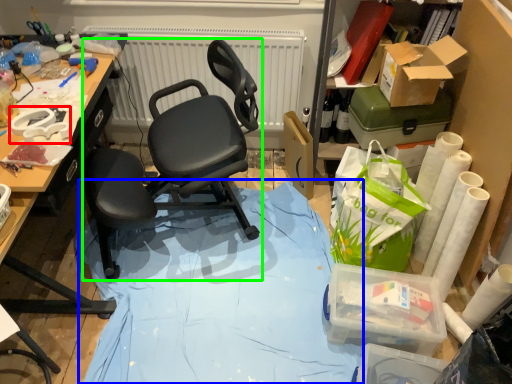
Question: Which is farther away from equipment (highlighted by a red box)? fabric (highlighted by a blue box) or chair (highlighted by a green box)?

Choices:
 (A) fabric
 (B) chair

Answer: (A)